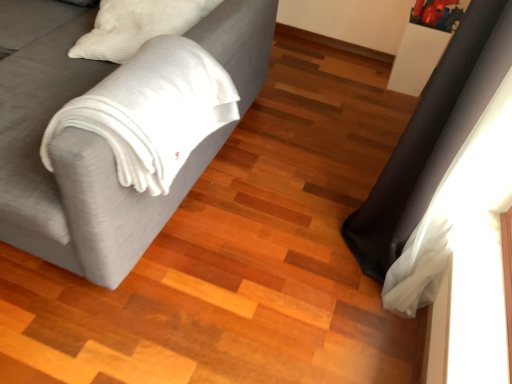
Question: Is black leather curtain at right inside or outside of velvet gray couch at left?

Choices:
 (A) inside
 (B) outside

Answer: (B)

Question: Considering the positions of point (465, 137) and point (45, 238), is point (465, 137) closer or farther from the camera than point (45, 238)?

Choices:
 (A) farther
 (B) closer

Answer: (B)

Question: Is black leather curtain at right taller or shorter than velvet gray couch at left?

Choices:
 (A) tall
 (B) short

Answer: (A)

Question: In terms of width, does velvet gray couch at left look wider or thinner when compared to black leather curtain at right?

Choices:
 (A) wide
 (B) thin

Answer: (A)

Question: From the image's perspective, relative to black leather curtain at right, is velvet gray couch at left above or below?

Choices:
 (A) below
 (B) above

Answer: (B)

Question: Looking at the image, does velvet gray couch at left seem bigger or smaller compared to black leather curtain at right?

Choices:
 (A) small
 (B) big

Answer: (B)

Question: Choose the correct answer: Is velvet gray couch at left inside black leather curtain at right or outside it?

Choices:
 (A) inside
 (B) outside

Answer: (B)